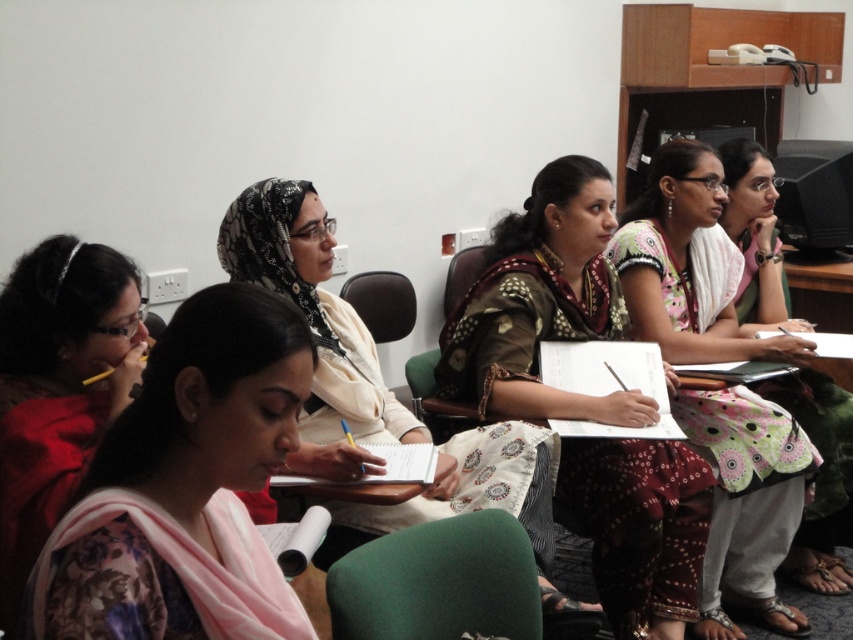
Looking at this image, is matte black scarf at lower left thinner than matte green dress at center?

Yes, matte black scarf at lower left is thinner than matte green dress at center.

Is matte black scarf at lower left smaller than matte green dress at center?

Yes, matte black scarf at lower left is smaller than matte green dress at center.

Who is more distant from viewer, (x=103, y=269) or (x=831, y=422)?

The point (x=831, y=422) is more distant.

Image resolution: width=853 pixels, height=640 pixels. In order to click on matte black scarf at lower left in this screenshot , I will do `click(57, 387)`.

Does polka dot fabric dress at center come behind matte black scarf at lower left?

That is True.

Does point (560, 492) lie in front of point (44, 451)?

No, (560, 492) is further to viewer.

You are a GUI agent. You are given a task and a screenshot of the screen. Output one action in this format:
    pyautogui.click(x=<x>, y=<y>)
    Task: Click on the polka dot fabric dress at center
    
    Given the screenshot: What is the action you would take?
    pyautogui.click(x=541, y=304)

Which is below, floral fabric scarf at lower left or printed cotton saree at center?

floral fabric scarf at lower left is lower down.

In order to click on floral fabric scarf at lower left in this screenshot , I will do `click(202, 458)`.